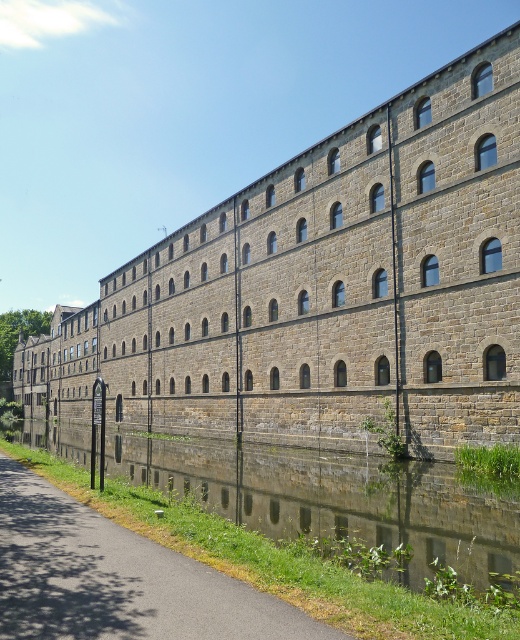
Question: Observing the image, what is the correct spatial positioning of brown stone building at center in reference to smooth asphalt path at lower center?

Choices:
 (A) below
 (B) above

Answer: (B)

Question: Does brown stone building at center have a larger size compared to smooth asphalt path at lower center?

Choices:
 (A) no
 (B) yes

Answer: (B)

Question: Where is brown stone building at center located in relation to smooth asphalt path at lower center in the image?

Choices:
 (A) below
 (B) above

Answer: (B)

Question: Which point is closer to the camera?

Choices:
 (A) [x=189, y=291]
 (B) [x=238, y=586]

Answer: (B)